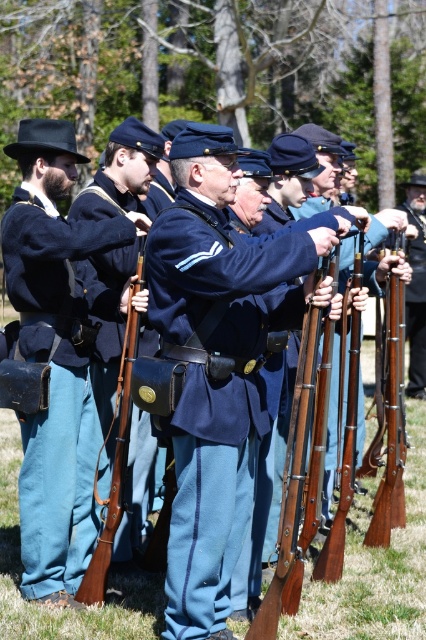
Question: Can you confirm if navy blue wool uniform at center is bigger than blue fabric uniform at center?

Choices:
 (A) no
 (B) yes

Answer: (B)

Question: From the image, what is the correct spatial relationship of brown wooden rifle at center in relation to blue fabric uniform at center?

Choices:
 (A) left
 (B) right

Answer: (A)

Question: Which point is farther to the camera?

Choices:
 (A) matte black uniform at left
 (B) brown wooden rifle at center

Answer: (B)

Question: Is matte black uniform at left further to the viewer compared to blue fabric uniform at center?

Choices:
 (A) no
 (B) yes

Answer: (A)

Question: Considering the real-world distances, which object is farthest from the blue fabric uniform at center?

Choices:
 (A) brown wooden rifle at center
 (B) matte black uniform at left
 (C) navy blue wool uniform at center

Answer: (C)

Question: Based on their relative distances, which object is farther from the brown wooden rifle at center?

Choices:
 (A) navy blue wool uniform at center
 (B) matte black uniform at left

Answer: (A)